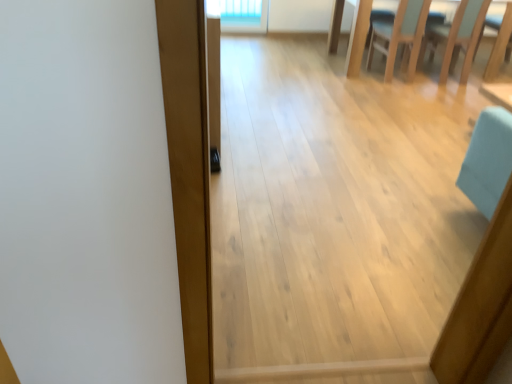
Question: From a real-world perspective, does light wood chair at upper right sit lower than light brown wood plank at center?

Choices:
 (A) no
 (B) yes

Answer: (B)

Question: Does light wood chair at upper right have a greater height compared to light brown wood plank at center?

Choices:
 (A) no
 (B) yes

Answer: (A)

Question: Is light wood chair at upper right wider than light brown wood plank at center?

Choices:
 (A) no
 (B) yes

Answer: (B)

Question: Is light wood chair at upper right looking in the opposite direction of light brown wood plank at center?

Choices:
 (A) yes
 (B) no

Answer: (B)

Question: Considering the relative sizes of light wood chair at upper right and light brown wood plank at center in the image provided, is light wood chair at upper right bigger than light brown wood plank at center?

Choices:
 (A) no
 (B) yes

Answer: (B)

Question: Does light wood chair at upper right come in front of light brown wood plank at center?

Choices:
 (A) yes
 (B) no

Answer: (B)

Question: Is light brown wood plank at center next to light wood chair at upper right?

Choices:
 (A) no
 (B) yes

Answer: (A)

Question: Can you confirm if light brown wood plank at center is taller than light wood chair at upper right?

Choices:
 (A) no
 (B) yes

Answer: (B)

Question: Is light brown wood plank at center thinner than light wood chair at upper right?

Choices:
 (A) no
 (B) yes

Answer: (B)

Question: Is light brown wood plank at center looking in the opposite direction of light wood chair at upper right?

Choices:
 (A) no
 (B) yes

Answer: (A)

Question: From the image's perspective, is light brown wood plank at center above light wood chair at upper right?

Choices:
 (A) yes
 (B) no

Answer: (B)

Question: Does light brown wood plank at center have a smaller size compared to light wood chair at upper right?

Choices:
 (A) no
 (B) yes

Answer: (B)

Question: From a real-world perspective, does light blue fabric chair at upper right sit lower than light wood chair at upper right?

Choices:
 (A) yes
 (B) no

Answer: (B)